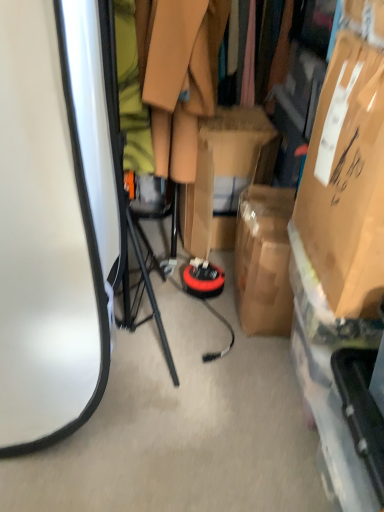
What are the coordinates of `brown cardboard box at right` in the screenshot? It's located at (347, 181).

What do you see at coordinates (347, 181) in the screenshot?
I see `brown cardboard box at right` at bounding box center [347, 181].

Locate an element on the screen. This screenshot has height=512, width=384. brown cardboard box at right is located at coordinates (347, 181).